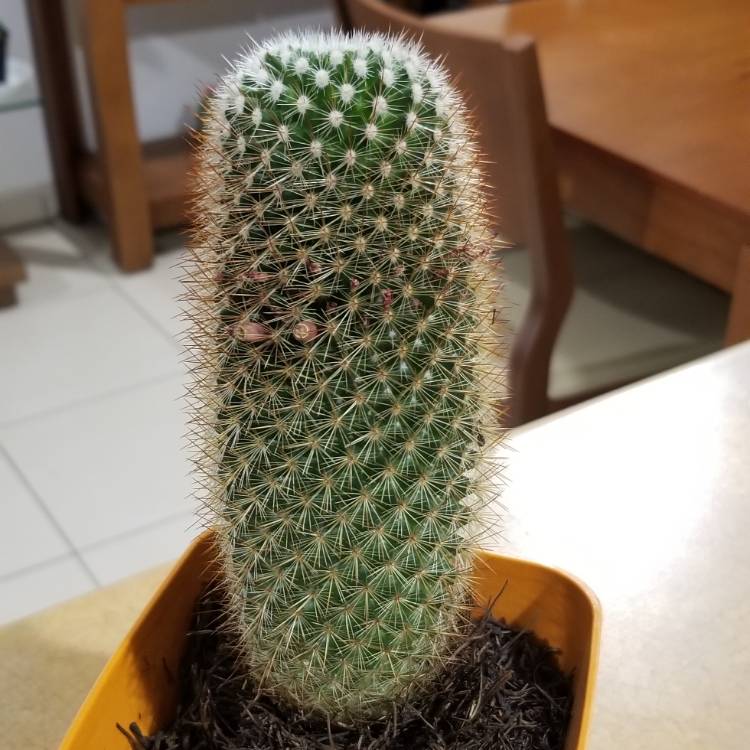
Find the location of a particular element. Image resolution: width=750 pixels, height=750 pixels. floor is located at coordinates (96, 414).